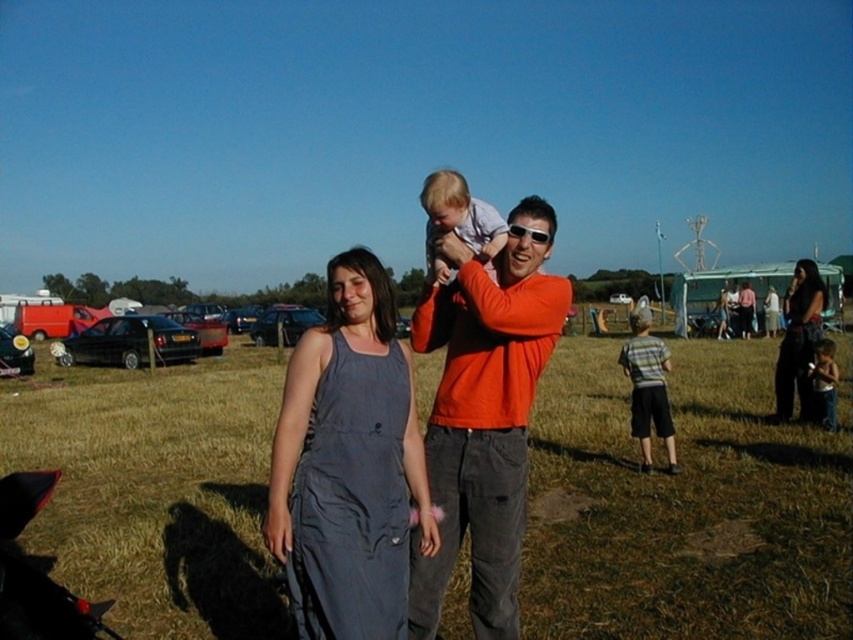
Question: Is light blue fabric shirt at center in front of light brown fabric baby at lower right?

Choices:
 (A) yes
 (B) no

Answer: (A)

Question: Is dark gray dress at right below orange cotton shirt at right?

Choices:
 (A) yes
 (B) no

Answer: (A)

Question: Which of these objects is positioned farthest from the light brown fabric baby at lower right?

Choices:
 (A) striped cotton shirt at lower right
 (B) light blue fabric shirt at center
 (C) orange cotton shirt at center
 (D) dark gray dress at right

Answer: (C)

Question: Which object is closer to the camera taking this photo?

Choices:
 (A) gray fabric dress at center
 (B) orange cotton shirt at center
 (C) orange cotton shirt at right

Answer: (A)

Question: Which point appears closest to the camera in this image?

Choices:
 (A) (630, 324)
 (B) (422, 192)
 (C) (833, 362)
 (D) (817, 268)

Answer: (B)

Question: Considering the relative positions of gray fabric dress at center and orange cotton shirt at right in the image provided, where is gray fabric dress at center located with respect to orange cotton shirt at right?

Choices:
 (A) left
 (B) right

Answer: (A)